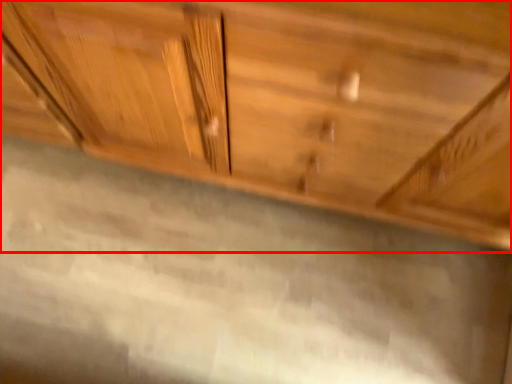
Question: From the image, what is the correct spatial relationship of cabinetry (annotated by the red box) in relation to granite?

Choices:
 (A) left
 (B) right

Answer: (B)